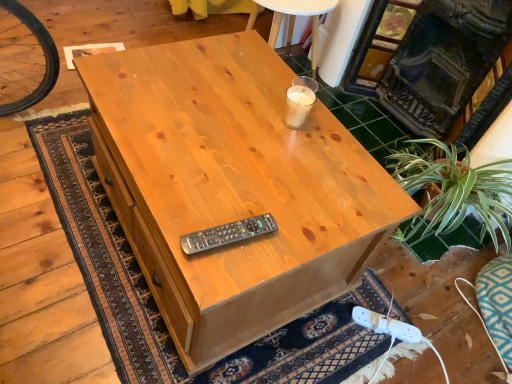
What are the coordinates of `free point to the right of black plastic remote at center` in the screenshot? It's located at (289, 237).